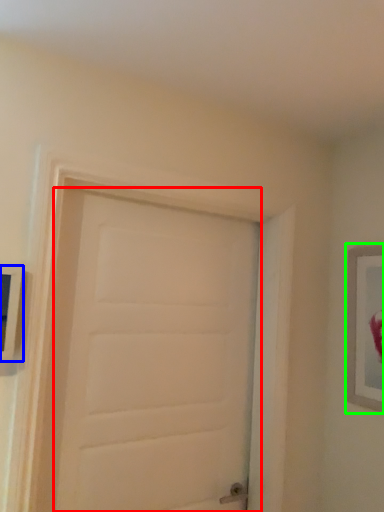
Question: Considering the real-world distances, which object is closest to door (highlighted by a red box)? picture frame (highlighted by a blue box) or picture frame (highlighted by a green box).

Choices:
 (A) picture frame
 (B) picture frame

Answer: (A)